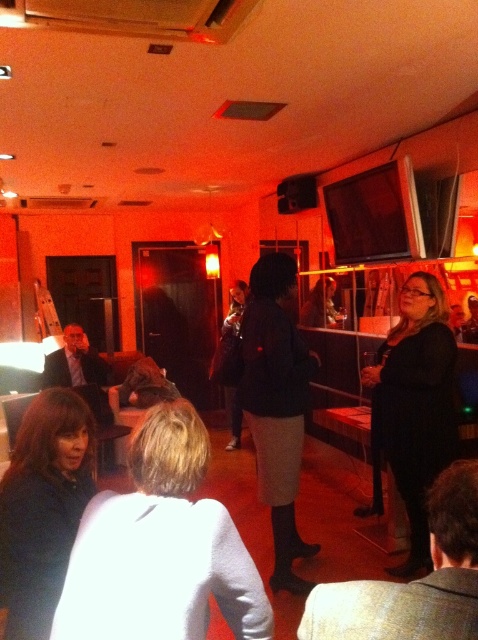
Question: Does matte black jacket at lower left appear under dark gray skirt at center?

Choices:
 (A) yes
 (B) no

Answer: (A)

Question: Which point is farther to the camera?

Choices:
 (A) (58, 458)
 (B) (427, 314)

Answer: (B)

Question: Based on their relative distances, which object is farther from the black leather jacket at lower center?

Choices:
 (A) matte black jacket at lower left
 (B) black matte dress at center

Answer: (B)

Question: Does matte black jacket at lower left appear on the left side of black leather jacket at lower center?

Choices:
 (A) yes
 (B) no

Answer: (A)

Question: Is matte black jacket at lower left closer to camera compared to black leather jacket at lower center?

Choices:
 (A) no
 (B) yes

Answer: (A)

Question: Among these objects, which one is nearest to the camera?

Choices:
 (A) dark gray skirt at center
 (B) black matte dress at center
 (C) matte black jacket at lower left
 (D) black leather jacket at lower center

Answer: (D)